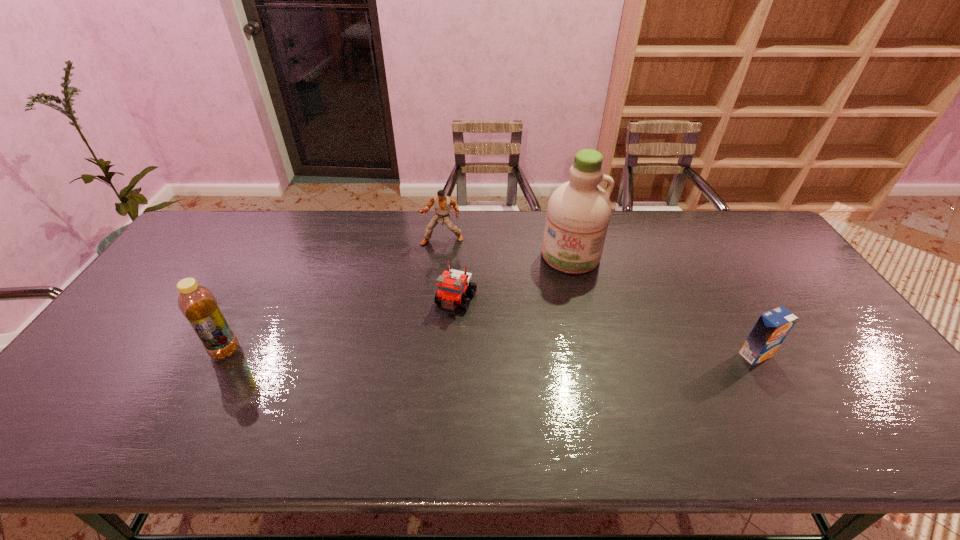
You are a GUI agent. You are given a task and a screenshot of the screen. Output one action in this format:
    pyautogui.click(x=<x>, y=<y>)
    Task: Click on the vacant space that satisfies the following two spatial constraints: 1. on the front side of the tallest object; 2. on the right side of the puncher
    
    Given the screenshot: What is the action you would take?
    pyautogui.click(x=441, y=256)

Locate an element on the screen. This screenshot has height=540, width=960. free space that satisfies the following two spatial constraints: 1. on the front side of the Lego; 2. on the left side of the rightmost object is located at coordinates (453, 355).

Locate an element on the screen. The width and height of the screenshot is (960, 540). vacant space that satisfies the following two spatial constraints: 1. on the back side of the tallest object; 2. on the left side of the Lego is located at coordinates (459, 256).